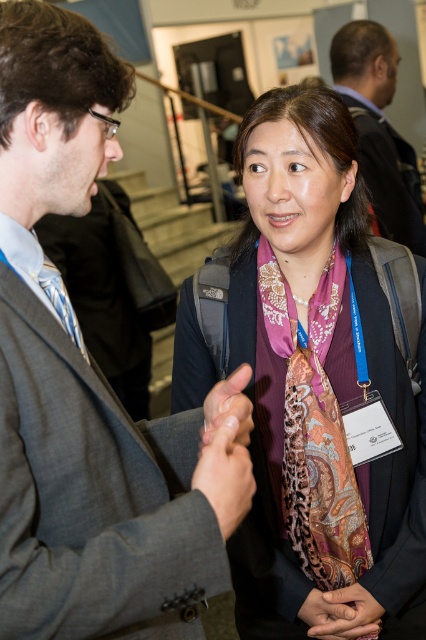
Does dark brown leather jacket at upper right have a smaller size compared to matte gray tie at left?

No, dark brown leather jacket at upper right is not smaller than matte gray tie at left.

Which is more to the left, dark brown leather jacket at upper right or matte gray tie at left?

matte gray tie at left

Find the location of a particular element. dark brown leather jacket at upper right is located at coordinates (379, 129).

This screenshot has width=426, height=640. What are the coordinates of `dark brown leather jacket at upper right` in the screenshot? It's located at (379, 129).

Does purple silk scarf at center have a lesser width compared to matte gray tie at left?

No.

Is purple silk scarf at center closer to the viewer compared to matte gray tie at left?

No.

This screenshot has height=640, width=426. What are the coordinates of `purple silk scarf at center` in the screenshot? It's located at (322, 369).

The height and width of the screenshot is (640, 426). I want to click on purple silk scarf at center, so click(322, 369).

The width and height of the screenshot is (426, 640). In order to click on gray suit at center in this screenshot , I will do `click(92, 387)`.

Describe the element at coordinates (92, 387) in the screenshot. This screenshot has height=640, width=426. I see `gray suit at center` at that location.

This screenshot has height=640, width=426. Find the location of `gray suit at center`. gray suit at center is located at coordinates (92, 387).